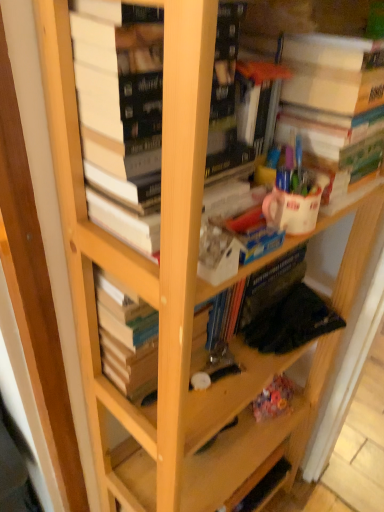
What are the coordinates of `vacant space underneath white matte paper at upper right, marked as the third book in a left-to-right arrangement (from a real-world perspective)` in the screenshot? It's located at (285, 319).